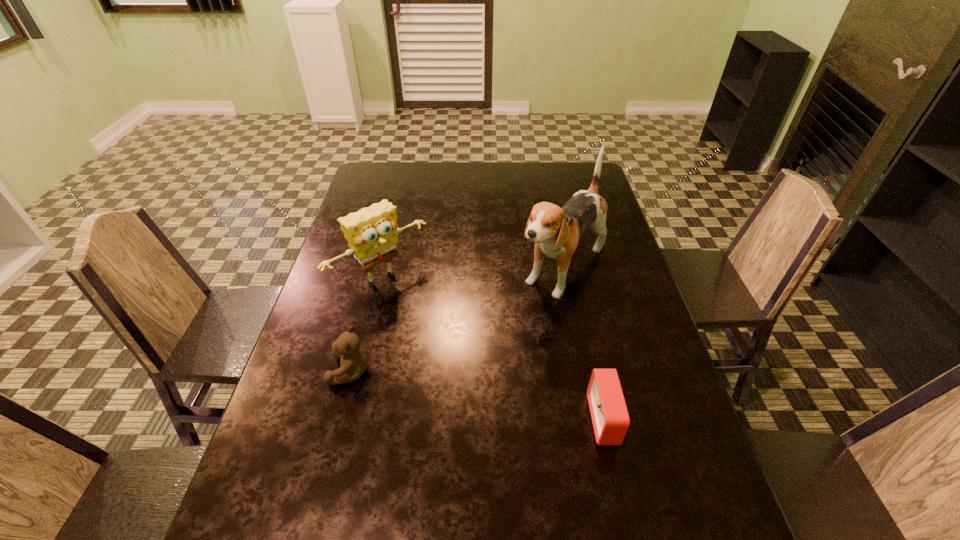
Where is `vacant space on the desktop that is between the teddy bear and the alarm clock and is positioned at the face of the puppy`? This screenshot has height=540, width=960. vacant space on the desktop that is between the teddy bear and the alarm clock and is positioned at the face of the puppy is located at coordinates (453, 390).

Where is `vacant space on the desktop that is between the second shortest object and the nearest object and is positioned on the face of the sponge`? The width and height of the screenshot is (960, 540). vacant space on the desktop that is between the second shortest object and the nearest object and is positioned on the face of the sponge is located at coordinates (500, 399).